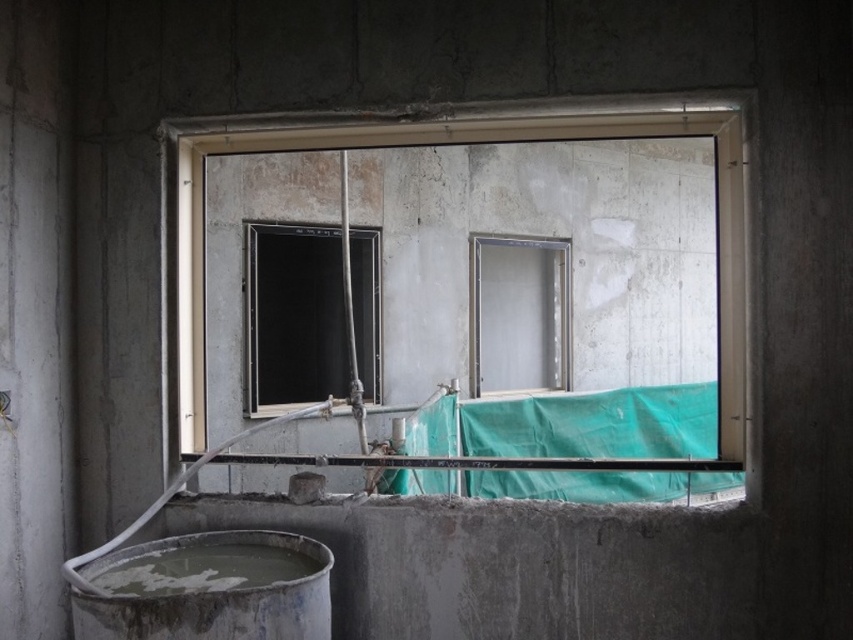
Does dirty concrete tub at lower left appear under clear glass door at center?

Correct, dirty concrete tub at lower left is located below clear glass door at center.

Describe the element at coordinates (207, 588) in the screenshot. I see `dirty concrete tub at lower left` at that location.

Based on the photo, who is more distant from viewer, (190, 563) or (503, 300)?

Positioned behind is point (503, 300).

The height and width of the screenshot is (640, 853). Find the location of `dirty concrete tub at lower left`. dirty concrete tub at lower left is located at coordinates (207, 588).

Does transparent glass window at center come behind clear glass door at center?

No, it is not.

Is point (332, 234) closer to viewer compared to point (527, 252)?

Yes, it is in front of point (527, 252).

Locate an element on the screen. The height and width of the screenshot is (640, 853). transparent glass window at center is located at coordinates (293, 316).

Is dirty concrete tub at lower left closer to the viewer compared to transparent glass window at center?

Yes, dirty concrete tub at lower left is closer to the viewer.

Is point (143, 589) closer to viewer compared to point (308, 312)?

Yes, point (143, 589) is closer to viewer.

Between point (160, 620) and point (282, 227), which one is positioned in front?

Point (160, 620)

Image resolution: width=853 pixels, height=640 pixels. What are the coordinates of `dirty concrete tub at lower left` in the screenshot? It's located at (207, 588).